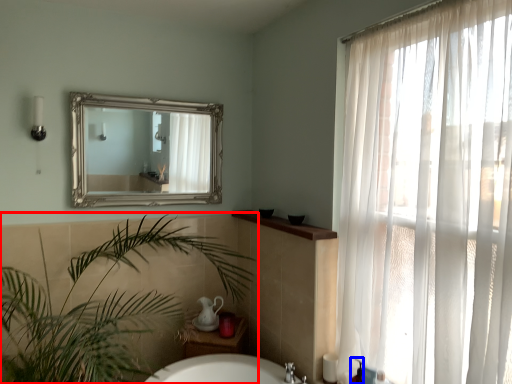
Question: Which object appears closest to the camera in this image, houseplant (highlighted by a red box) or toiletry (highlighted by a blue box)?

Choices:
 (A) houseplant
 (B) toiletry

Answer: (A)